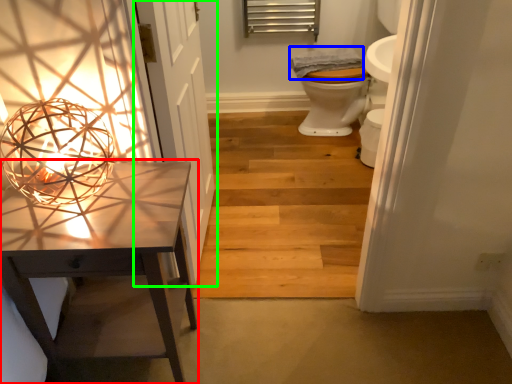
Question: Which object is the farthest from table (highlighted by a red box)? Choose among these: material (highlighted by a blue box) or door (highlighted by a green box).

Choices:
 (A) material
 (B) door

Answer: (A)